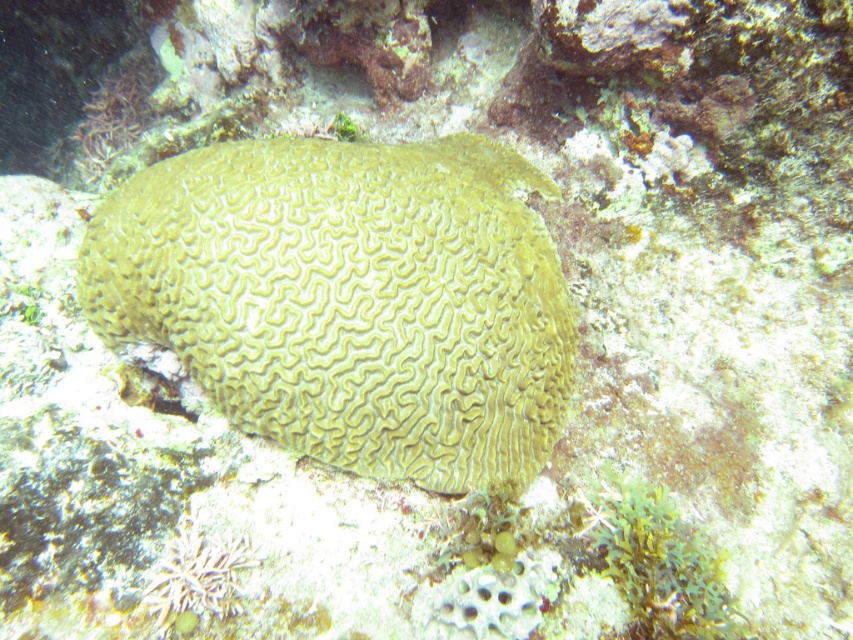
Who is lower down, yellow brain coral at center or green matte algae at lower right?

green matte algae at lower right is lower down.

Does point (459, 177) come closer to viewer compared to point (633, 500)?

No, (459, 177) is further to viewer.

Does point (433, 470) lie in front of point (624, 582)?

No, (433, 470) is further to viewer.

I want to click on yellow brain coral at center, so click(349, 298).